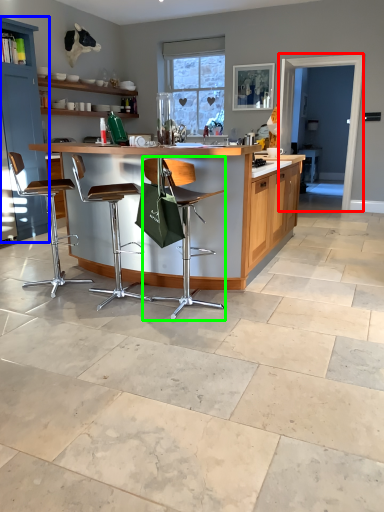
Question: Considering the real-world distances, which object is farthest from glass door (highlighted by a red box)? cabinetry (highlighted by a blue box) or chair (highlighted by a green box)?

Choices:
 (A) cabinetry
 (B) chair

Answer: (B)